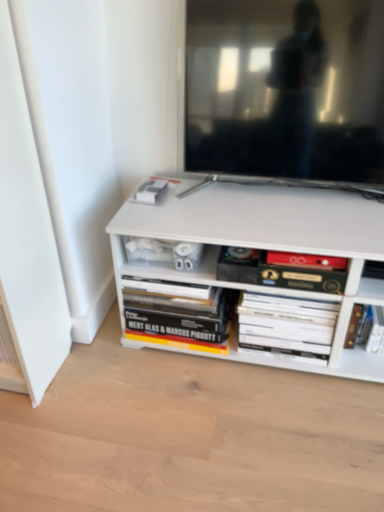
Locate an element on the screen. free space in front of hardcover book at lower center, which is the 1th book from left to right is located at coordinates (172, 384).